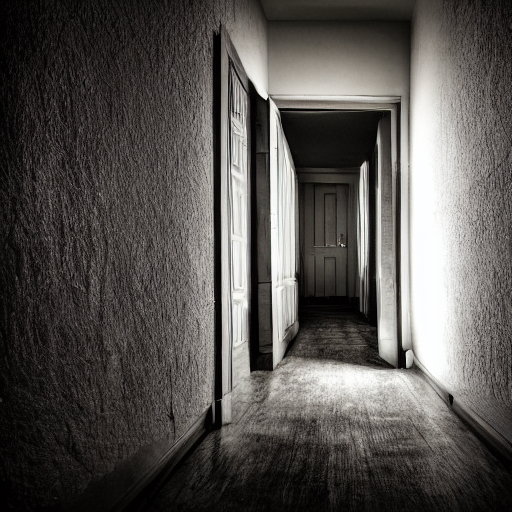
The width and height of the screenshot is (512, 512). Identify the location of ceiling. (327, 7).